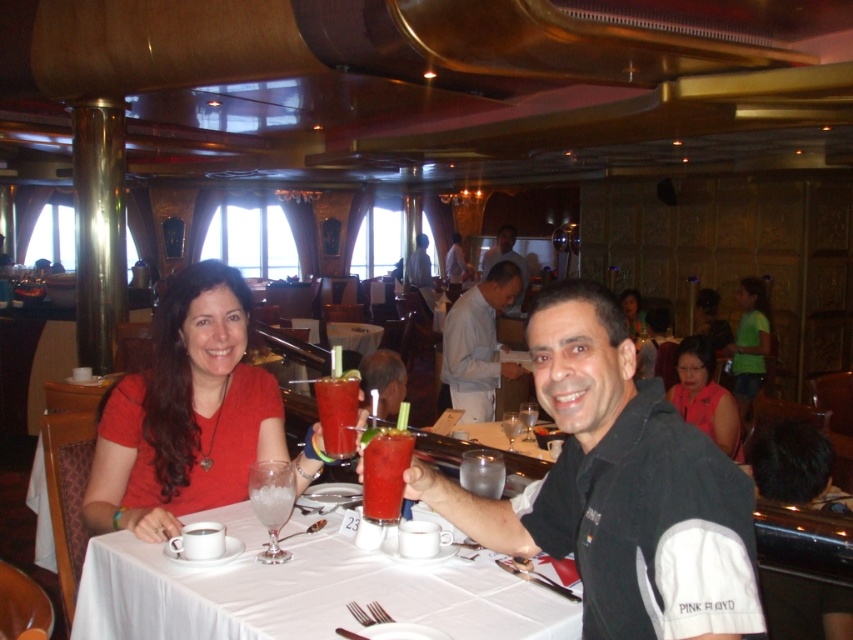
Question: Does matte red dress at center have a larger size compared to translucent glass drink at table center?

Choices:
 (A) yes
 (B) no

Answer: (A)

Question: Is matte red dress at center further to the viewer compared to pink matte shirt at center?

Choices:
 (A) no
 (B) yes

Answer: (A)

Question: Among these points, which one is farthest from the camera?

Choices:
 (A) (683, 355)
 (B) (364, 371)
 (C) (624, 304)
 (D) (517, 273)

Answer: (C)

Question: Can you confirm if black matte shirt at center is smaller than white glossy table at center?

Choices:
 (A) no
 (B) yes

Answer: (A)

Question: Which point is farther from the camera taking this photo?

Choices:
 (A) (693, 360)
 (B) (340, 570)

Answer: (A)

Question: Which of the following is the farthest from the observer?

Choices:
 (A) (689, 342)
 (B) (368, 396)
 (C) (283, 490)

Answer: (A)